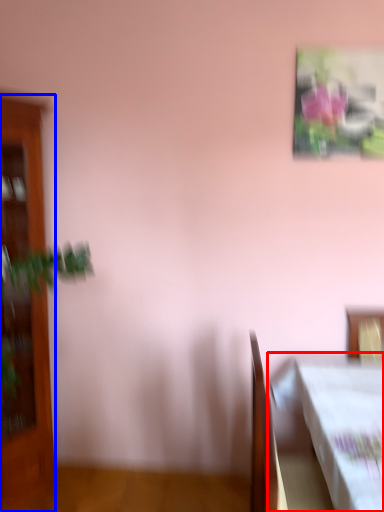
Question: Among these objects, which one is nearest to the camera, table (highlighted by a red box) or furniture (highlighted by a blue box)?

Choices:
 (A) table
 (B) furniture

Answer: (A)